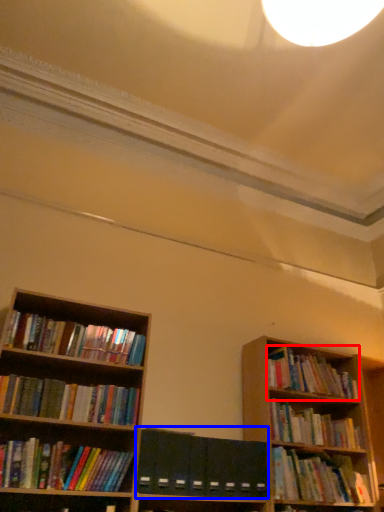
Question: Which object is further to the camera taking this photo, book (highlighted by a red box) or paperback book (highlighted by a blue box)?

Choices:
 (A) book
 (B) paperback book

Answer: (A)